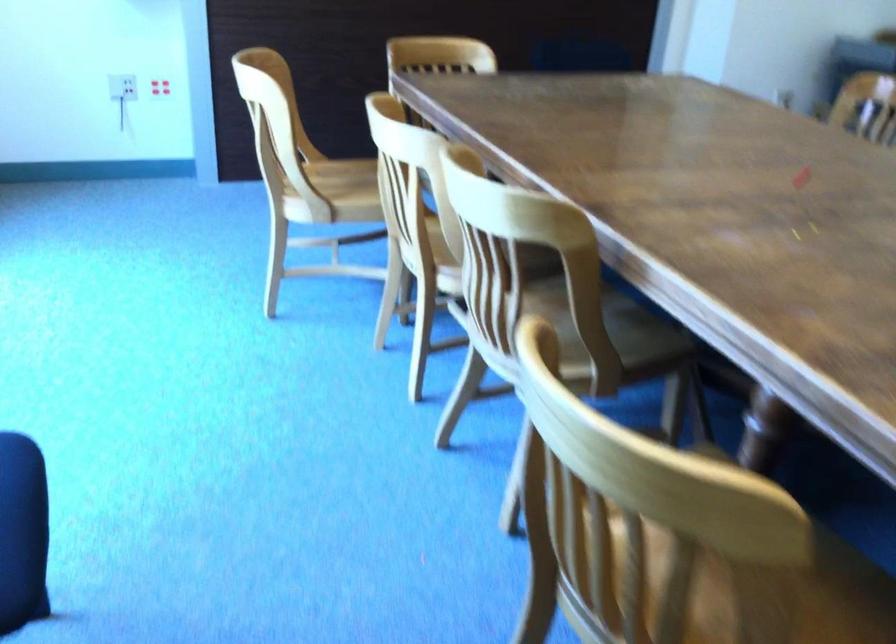
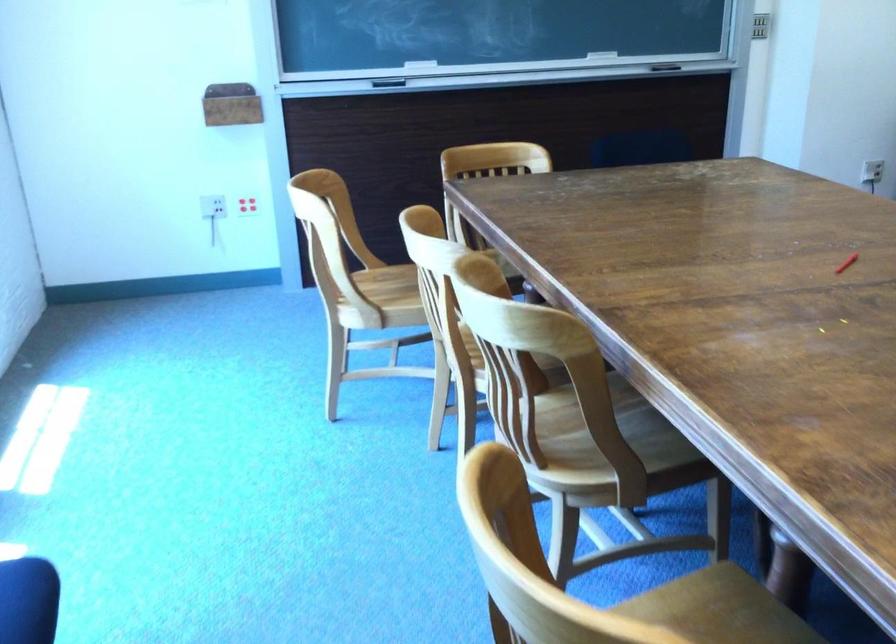
In the second image, find the point that corresponds to (595,314) in the first image.

(606, 422)